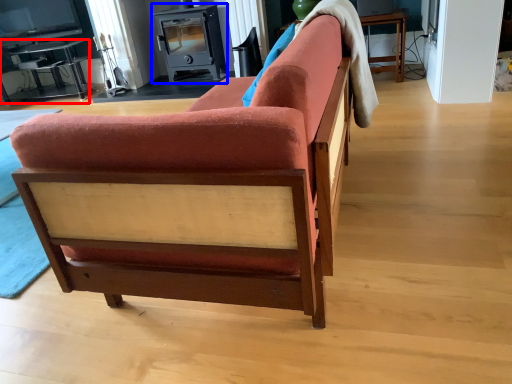
Question: Which object appears farthest to the camera in this image, table (highlighted by a red box) or appliance (highlighted by a blue box)?

Choices:
 (A) table
 (B) appliance

Answer: (A)